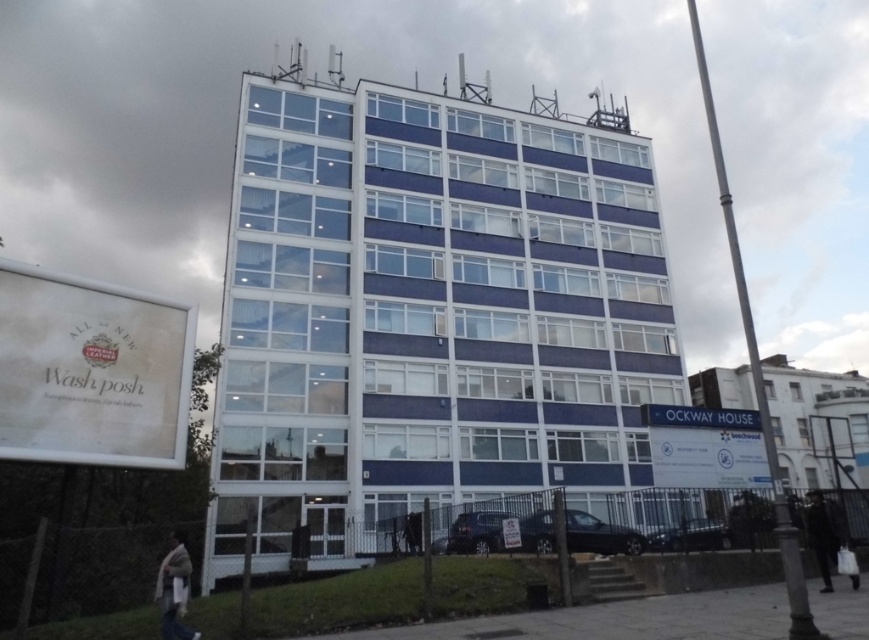
How distant is beige knitted scarf at lower left from dark wool coat at lower right?

beige knitted scarf at lower left is 9.10 meters from dark wool coat at lower right.

Is point (167, 593) positioned in front of point (813, 500)?

Yes, point (167, 593) is closer to viewer.

Identify the location of beige knitted scarf at lower left. The height and width of the screenshot is (640, 869). (174, 589).